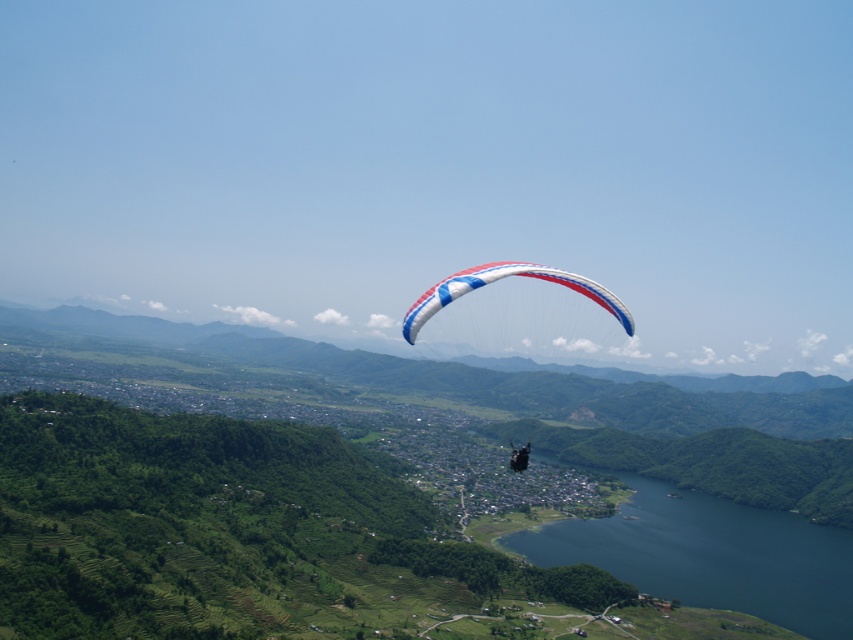
Question: Is the position of blue glossy water at lower center more distant than that of white fabric parachute at center?

Choices:
 (A) no
 (B) yes

Answer: (B)

Question: Among these objects, which one is farthest from the camera?

Choices:
 (A) white and blue fabric parachute at center
 (B) blue glossy water at lower center

Answer: (B)

Question: Estimate the real-world distances between objects in this image. Which object is farther from the white fabric parachute at center?

Choices:
 (A) blue glossy water at lower center
 (B) white and blue fabric parachute at center

Answer: (A)

Question: Which point is farther from the camera taking this photo?

Choices:
 (A) click(x=456, y=282)
 (B) click(x=619, y=305)
 (C) click(x=756, y=536)

Answer: (C)

Question: Is blue glossy water at lower center positioned at the back of white fabric parachute at center?

Choices:
 (A) yes
 (B) no

Answer: (A)

Question: Does blue glossy water at lower center have a smaller size compared to white fabric parachute at center?

Choices:
 (A) no
 (B) yes

Answer: (B)